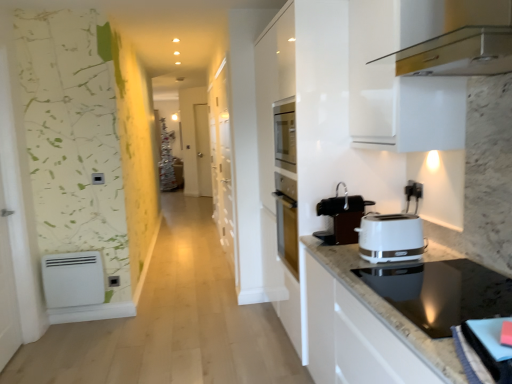
Question: Is black plastic electric outlet at upper right, the 1th electric outlet when ordered from right to left, thinner than black glass cooktop at lower right, the second home appliance when ordered from top to bottom?

Choices:
 (A) no
 (B) yes

Answer: (B)

Question: From a real-world perspective, is black plastic electric outlet at upper right, which is counted as the first electric outlet, starting from the front, positioned under black glass cooktop at lower right, acting as the first home appliance starting from the bottom, based on gravity?

Choices:
 (A) yes
 (B) no

Answer: (B)

Question: From a real-world perspective, is black plastic electric outlet at upper right, positioned as the first electric outlet in top-to-bottom order, on black glass cooktop at lower right, the second home appliance when ordered from top to bottom?

Choices:
 (A) yes
 (B) no

Answer: (A)

Question: Is black plastic electric outlet at upper right, the 1th electric outlet when ordered from right to left, not within black glass cooktop at lower right, the second home appliance when ordered from top to bottom?

Choices:
 (A) yes
 (B) no

Answer: (A)

Question: Does black plastic electric outlet at upper right, positioned as the first electric outlet in top-to-bottom order, turn towards black glass cooktop at lower right, acting as the first home appliance starting from the bottom?

Choices:
 (A) no
 (B) yes

Answer: (A)

Question: Is black plastic electric outlet at upper right, arranged as the second electric outlet when ordered from the bottom, in front of black glass cooktop at lower right, acting as the first home appliance starting from the bottom?

Choices:
 (A) no
 (B) yes

Answer: (A)

Question: Is the depth of black plastic electric outlet at upper right, positioned as the first electric outlet in top-to-bottom order, greater than that of white glossy toaster at right?

Choices:
 (A) no
 (B) yes

Answer: (B)

Question: Does black plastic electric outlet at upper right, arranged as the second electric outlet when ordered from the bottom, have a larger size compared to white glossy toaster at right?

Choices:
 (A) yes
 (B) no

Answer: (B)

Question: Considering the relative positions of black plastic electric outlet at upper right, marked as the 2th electric outlet in a left-to-right arrangement, and white glossy toaster at right in the image provided, is black plastic electric outlet at upper right, marked as the 2th electric outlet in a left-to-right arrangement, to the right of white glossy toaster at right from the viewer's perspective?

Choices:
 (A) no
 (B) yes

Answer: (B)

Question: Can you confirm if black plastic electric outlet at upper right, positioned as the first electric outlet in top-to-bottom order, is shorter than white glossy toaster at right?

Choices:
 (A) yes
 (B) no

Answer: (A)

Question: Considering the relative sizes of black plastic electric outlet at upper right, marked as the 2th electric outlet in a left-to-right arrangement, and white glossy toaster at right in the image provided, is black plastic electric outlet at upper right, marked as the 2th electric outlet in a left-to-right arrangement, wider than white glossy toaster at right?

Choices:
 (A) no
 (B) yes

Answer: (A)

Question: Is black plastic electric outlet at upper right, which is counted as the first electric outlet, starting from the front, to the left of white glossy toaster at right from the viewer's perspective?

Choices:
 (A) no
 (B) yes

Answer: (A)

Question: From a real-world perspective, is black plastic electric outlet at lower left, the first electric outlet when ordered from left to right, over metallic gold range hood at upper right, the first home appliance positioned from the top?

Choices:
 (A) no
 (B) yes

Answer: (A)